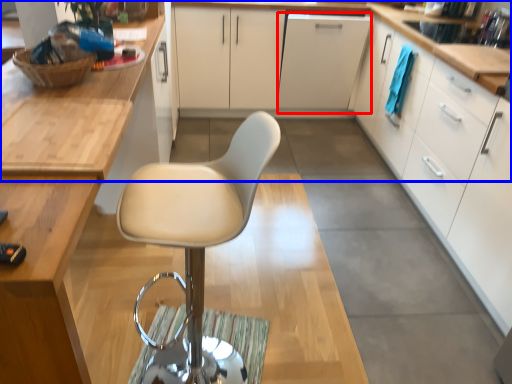
Question: Which of the following is the farthest to the observer, file cabinet (highlighted by a red box) or countertop (highlighted by a blue box)?

Choices:
 (A) file cabinet
 (B) countertop

Answer: (A)